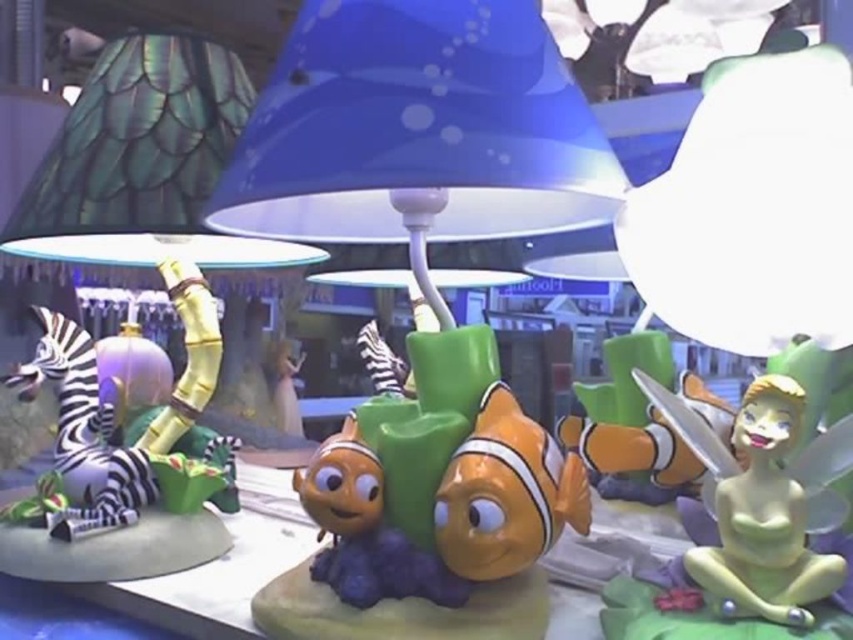
You are a visitor at the themed attraction and want to take a photo of both the green rubber tinker bell at lower right and the orange matte clownfish at center. Which one should you focus on first to ensure both are in the frame?

You should focus on the orange matte clownfish at center first because the green rubber tinker bell at lower right is in front of it, so adjusting the camera to include both would require ensuring the clownfish is within the frame while accounting for the tinker bell being closer to the lens.

You are a visitor standing in front of the display and want to take a photo of the orange matte clownfish at center. If your camera can focus on objects up to 24 inches away, will it be able to focus on the clownfish?

The orange matte clownfish at center is 24.40 inches from viewer, which is slightly beyond the camera focus range of 24 inches. Therefore, the camera may not focus properly on the clownfish.